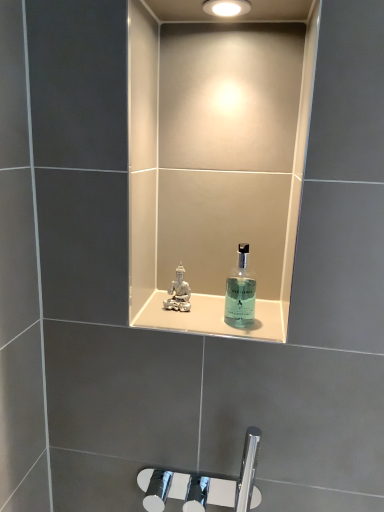
Describe the element at coordinates (212, 317) in the screenshot. The height and width of the screenshot is (512, 384). I see `translucent glass shelf at center` at that location.

What are the coordinates of `transparent glass bottle at center` in the screenshot? It's located at (240, 293).

Where is `translucent glass shelf at center`? The height and width of the screenshot is (512, 384). translucent glass shelf at center is located at coordinates (212, 317).

Is translucent glass shelf at center thinner than matte white light fixture at upper center?

No, translucent glass shelf at center is not thinner than matte white light fixture at upper center.

Can you tell me how much translucent glass shelf at center and matte white light fixture at upper center differ in facing direction?

3.4 degrees separate the facing orientations of translucent glass shelf at center and matte white light fixture at upper center.

Is point (139, 317) in front of point (232, 1)?

No.

Locate an element on the screen. The height and width of the screenshot is (512, 384). ledge below the matte white light fixture at upper center (from a real-world perspective) is located at coordinates (212, 317).

From the image's perspective, would you say transparent glass bottle at center is positioned over matte white light fixture at upper center?

No.

Does point (239, 264) come behind point (244, 12)?

Yes, it is.

Would you say matte white light fixture at upper center is part of transparent glass bottle at center's contents?

No, matte white light fixture at upper center is not surrounded by transparent glass bottle at center.

What's the angular difference between transparent glass bottle at center and matte white light fixture at upper center's facing directions?

3.24 degrees separate the facing orientations of transparent glass bottle at center and matte white light fixture at upper center.

Does translucent glass shelf at center come behind transparent glass bottle at center?

Yes, translucent glass shelf at center is further from the camera.

Identify the location of bottle on the right of translucent glass shelf at center. (240, 293).

From the image's perspective, does translucent glass shelf at center appear higher than transparent glass bottle at center?

No, from the image's perspective, translucent glass shelf at center is not above transparent glass bottle at center.

Does translucent glass shelf at center appear on the right side of transparent glass bottle at center?

No.

How different are the orientations of matte white light fixture at upper center and translucent glass shelf at center in degrees?

3.4 degrees separate the facing orientations of matte white light fixture at upper center and translucent glass shelf at center.

From the image's perspective, which is below, matte white light fixture at upper center or translucent glass shelf at center?

translucent glass shelf at center is shown below in the image.

How far apart are matte white light fixture at upper center and translucent glass shelf at center?

matte white light fixture at upper center is 24.24 inches from translucent glass shelf at center.

Looking at the image, does matte white light fixture at upper center seem bigger or smaller compared to translucent glass shelf at center?

In the image, matte white light fixture at upper center appears to be smaller than translucent glass shelf at center.

Considering the positions of point (208, 7) and point (240, 286), is point (208, 7) closer or farther from the camera than point (240, 286)?

Clearly, point (208, 7) is closer to the camera than point (240, 286).

Could you tell me if matte white light fixture at upper center is turned towards transparent glass bottle at center?

No, matte white light fixture at upper center is not facing towards transparent glass bottle at center.

Which of these two, matte white light fixture at upper center or transparent glass bottle at center, is wider?

matte white light fixture at upper center is wider.

Could you measure the distance between matte white light fixture at upper center and transparent glass bottle at center?

56.34 centimeters.

Does transparent glass bottle at center contain translucent glass shelf at center?

No, translucent glass shelf at center is located outside of transparent glass bottle at center.

Is transparent glass bottle at center shorter than translucent glass shelf at center?

No.

From a real-world perspective, which object stands above the other?

transparent glass bottle at center.

This screenshot has width=384, height=512. In the image, there is a translucent glass shelf at center. What are the coordinates of `bottle above it (from the image's perspective)` in the screenshot? It's located at (240, 293).

Find the location of a particular element. This screenshot has width=384, height=512. light fixture that is above the translucent glass shelf at center (from a real-world perspective) is located at coordinates (226, 7).

Where is `bottle that appears on the right of matte white light fixture at upper center`? This screenshot has width=384, height=512. bottle that appears on the right of matte white light fixture at upper center is located at coordinates (240, 293).

In the scene shown: Based on their spatial positions, is translucent glass shelf at center or matte white light fixture at upper center further from transparent glass bottle at center?

matte white light fixture at upper center lies further to transparent glass bottle at center than the other object.

Based on their spatial positions, is translucent glass shelf at center or transparent glass bottle at center further from matte white light fixture at upper center?

translucent glass shelf at center is positioned further to the anchor matte white light fixture at upper center.

Considering their positions, is matte white light fixture at upper center positioned further to translucent glass shelf at center than transparent glass bottle at center?

Based on the image, matte white light fixture at upper center appears to be further to translucent glass shelf at center.

Consider the image. From the image, which object appears to be nearer to transparent glass bottle at center, matte white light fixture at upper center or translucent glass shelf at center?

Based on the image, translucent glass shelf at center appears to be nearer to transparent glass bottle at center.

When comparing their distances from matte white light fixture at upper center, does transparent glass bottle at center or translucent glass shelf at center seem closer?

Among the two, transparent glass bottle at center is located nearer to matte white light fixture at upper center.

Based on the photo, looking at the image, which one is located closer to translucent glass shelf at center, transparent glass bottle at center or matte white light fixture at upper center?

The object closer to translucent glass shelf at center is transparent glass bottle at center.

Find the location of a particular element. This screenshot has width=384, height=512. bottle between matte white light fixture at upper center and translucent glass shelf at center from top to bottom is located at coordinates (240, 293).